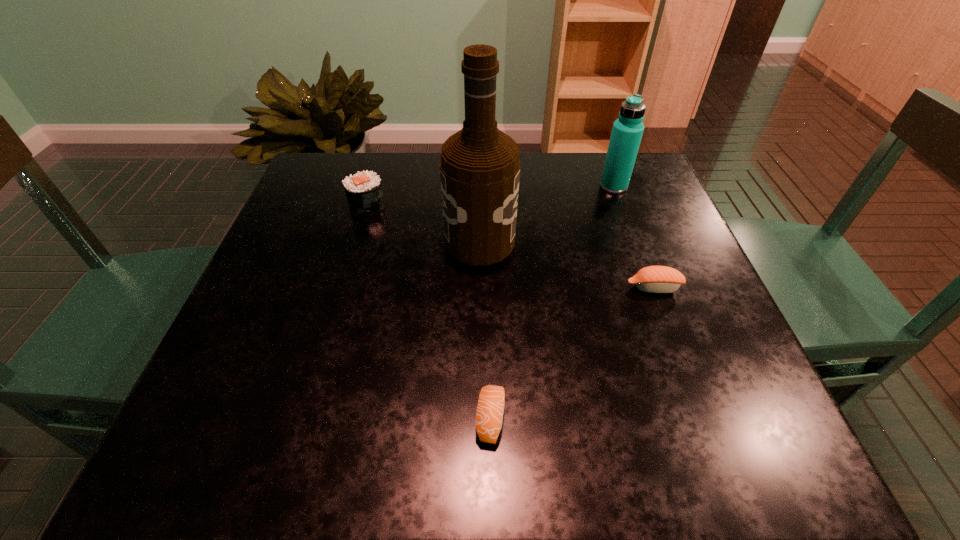
The width and height of the screenshot is (960, 540). What are the coordinates of `the tallest object` in the screenshot? It's located at (479, 166).

Locate an element on the screen. This screenshot has width=960, height=540. alcohol is located at coordinates (479, 166).

In order to click on the farthest object in this screenshot , I will do point(627,131).

Where is `the second tallest object`? the second tallest object is located at coordinates (627, 131).

Identify the location of the leftmost sushi. (363, 190).

The image size is (960, 540). Find the location of `the tallest sushi`. the tallest sushi is located at coordinates (363, 190).

Locate an element on the screen. The image size is (960, 540). the second farthest sushi is located at coordinates (654, 279).

Locate an element on the screen. The image size is (960, 540). the second nearest object is located at coordinates (654, 279).

What are the coordinates of `the nearest object` in the screenshot? It's located at (489, 416).

Where is `the shortest object`? the shortest object is located at coordinates (489, 416).